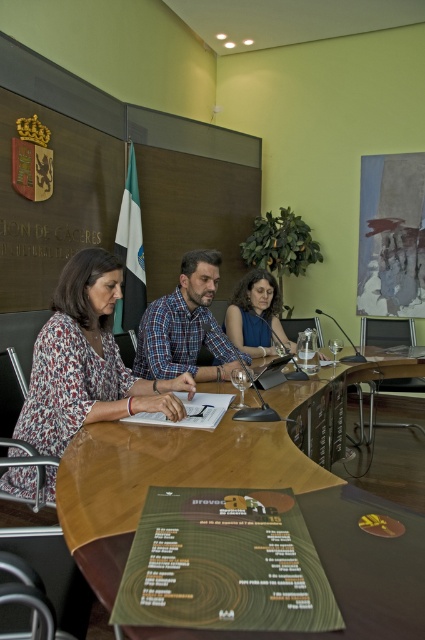
Question: Can you confirm if wooden table at center is positioned below matte black hair at center?

Choices:
 (A) no
 (B) yes

Answer: (B)

Question: Among these points, which one is nearest to the camera?

Choices:
 (A) (201, 310)
 (B) (252, 289)
 (C) (90, 358)
 (D) (237, 408)

Answer: (C)

Question: Does wooden table at center appear on the left side of matte black hair at center?

Choices:
 (A) no
 (B) yes

Answer: (A)

Question: Does floral fabric blouse at left appear over transparent glass at center?

Choices:
 (A) no
 (B) yes

Answer: (B)

Question: Estimate the real-world distances between objects in this image. Which object is farther from the blue plaid shirt at center?

Choices:
 (A) floral fabric blouse at left
 (B) transparent glass at center
 (C) matte black hair at center
 (D) wooden table at center

Answer: (C)

Question: Estimate the real-world distances between objects in this image. Which object is closer to the blue plaid shirt at center?

Choices:
 (A) matte black hair at center
 (B) floral fabric blouse at left
 (C) transparent glass at center

Answer: (B)